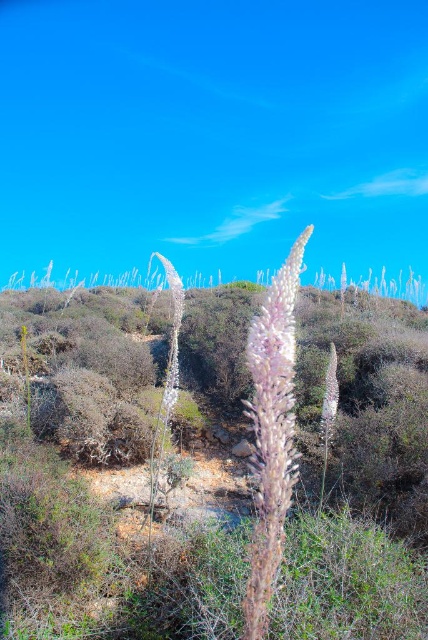
What is the location of the fuzzy pink flower at center in the image?

The fuzzy pink flower at center is located at point (272,432).

You are a gardener looking at the image. You notice two plants at the center of the scene. Which one is positioned higher up between the fuzzy pink flower at center and the white fuzzy plant at center?

The fuzzy pink flower at center is positioned higher up than the white fuzzy plant at center.

You are a botanist examining two plants in the center of the image. The fuzzy pink flower at center and the white fuzzy plant at center. Which one has a smaller diameter?

The fuzzy pink flower at center is thinner than the white fuzzy plant at center, so the fuzzy pink flower at center has a smaller diameter.